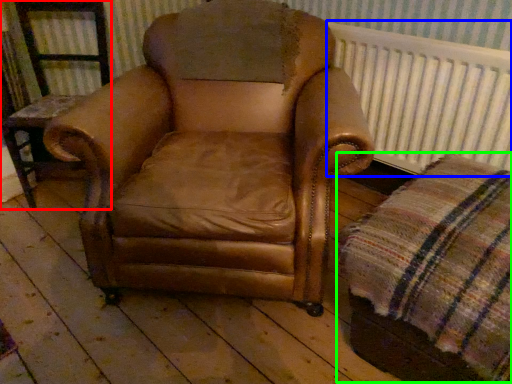
Question: Considering the real-world distances, which object is closest to furniture (highlighted by a red box)? radiator (highlighted by a blue box) or plaid (highlighted by a green box).

Choices:
 (A) radiator
 (B) plaid

Answer: (A)